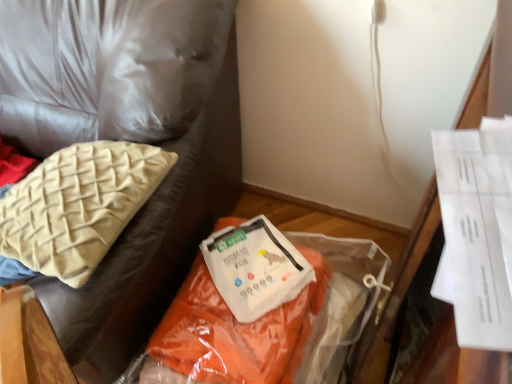
Question: From the image's perspective, is orange fabric bag at lower right over beige woven cushion at upper left?

Choices:
 (A) yes
 (B) no

Answer: (A)

Question: From a real-world perspective, is orange fabric bag at lower right under beige woven cushion at upper left?

Choices:
 (A) yes
 (B) no

Answer: (A)

Question: From a real-world perspective, is orange fabric bag at lower right positioned over beige woven cushion at upper left based on gravity?

Choices:
 (A) no
 (B) yes

Answer: (A)

Question: Is orange fabric bag at lower right to the left of beige woven cushion at upper left from the viewer's perspective?

Choices:
 (A) no
 (B) yes

Answer: (B)

Question: Can you confirm if orange fabric bag at lower right is thinner than beige woven cushion at upper left?

Choices:
 (A) yes
 (B) no

Answer: (B)

Question: Does orange fabric bag at lower right have a greater width compared to beige woven cushion at upper left?

Choices:
 (A) yes
 (B) no

Answer: (A)

Question: Is orange fabric bag at lower right to the left of orange fabric at center from the viewer's perspective?

Choices:
 (A) no
 (B) yes

Answer: (B)

Question: From a real-world perspective, is orange fabric bag at lower right under orange fabric at center?

Choices:
 (A) yes
 (B) no

Answer: (B)

Question: Is orange fabric bag at lower right placed right next to orange fabric at center?

Choices:
 (A) no
 (B) yes

Answer: (A)

Question: From the image's perspective, is orange fabric bag at lower right located above orange fabric at center?

Choices:
 (A) no
 (B) yes

Answer: (B)

Question: Does orange fabric bag at lower right appear on the right side of orange fabric at center?

Choices:
 (A) no
 (B) yes

Answer: (A)

Question: Considering the relative sizes of orange fabric bag at lower right and orange fabric at center in the image provided, is orange fabric bag at lower right bigger than orange fabric at center?

Choices:
 (A) yes
 (B) no

Answer: (A)

Question: Can you confirm if beige woven cushion at upper left is smaller than orange fabric at center?

Choices:
 (A) yes
 (B) no

Answer: (A)